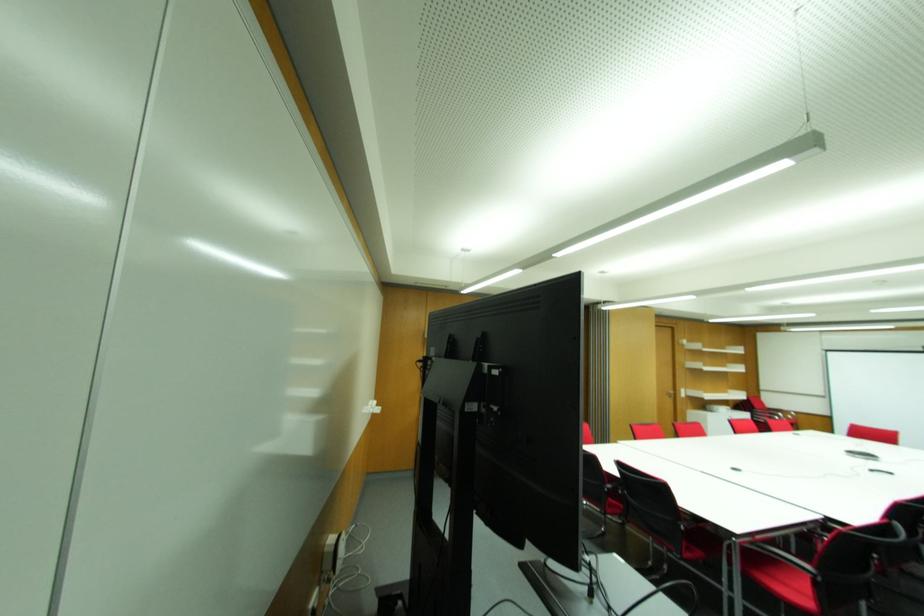
Image resolution: width=924 pixels, height=616 pixels. What do you see at coordinates (782, 570) in the screenshot? I see `the red chair sitting surface` at bounding box center [782, 570].